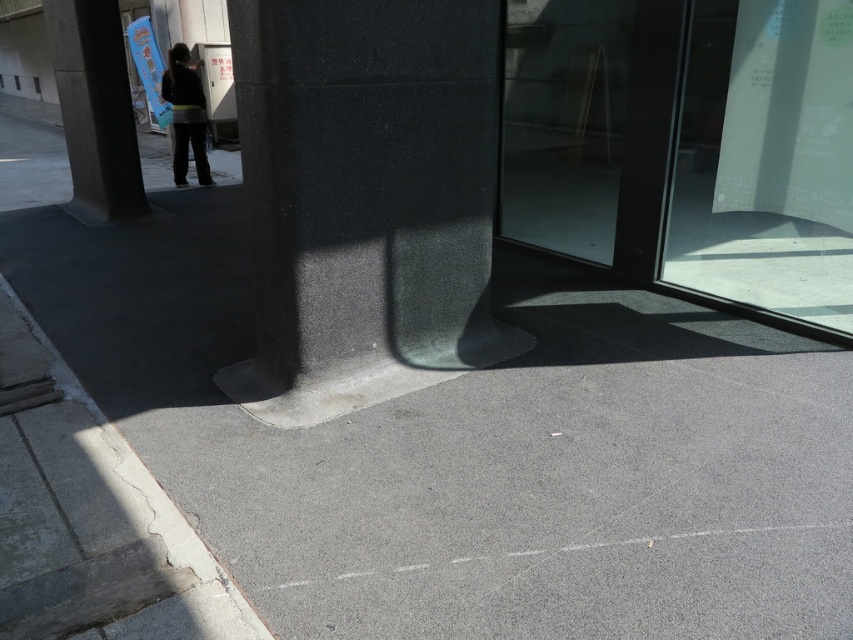
Question: Among these points, which one is nearest to the camera?

Choices:
 (A) (119, 492)
 (B) (479, 36)

Answer: (A)

Question: Which point is farther to the camera?

Choices:
 (A) transparent glass door at right
 (B) black granite pillar at center
 (C) dark gray pants at upper left
 (D) gray concrete curb at lower left

Answer: (A)

Question: Does transparent glass door at right appear over gray concrete curb at lower left?

Choices:
 (A) yes
 (B) no

Answer: (A)

Question: Is the position of matte gray pillar at upper left more distant than that of dark gray pants at upper left?

Choices:
 (A) no
 (B) yes

Answer: (A)

Question: Which of the following is the closest to the observer?

Choices:
 (A) dark gray pants at upper left
 (B) matte gray pillar at upper left
 (C) black granite pillar at center

Answer: (C)

Question: Does transparent glass door at right appear under black granite pillar at center?

Choices:
 (A) no
 (B) yes

Answer: (A)